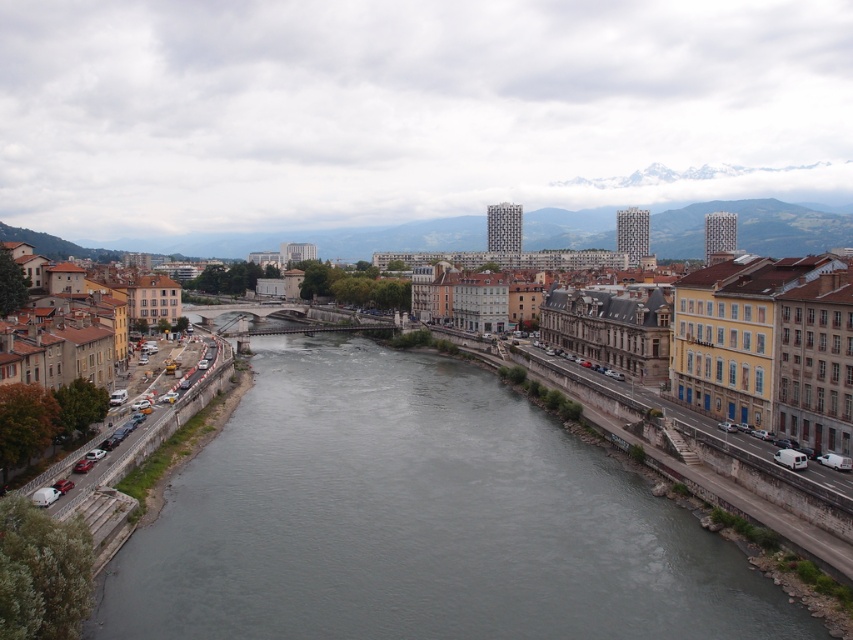
You are a city planner reviewing this image. The city is planning to install a new pedestrian walkway that must be placed exactly at the center of the image. Given the smooth concrete bridge at center is already present, will the new walkway overlap with the bridge?

The smooth concrete bridge at center is located at point (x=752, y=228), which is not the exact center of the image. The exact center would be at point (x=426, y=320). Therefore, the new pedestrian walkway at the center will not overlap with the bridge.